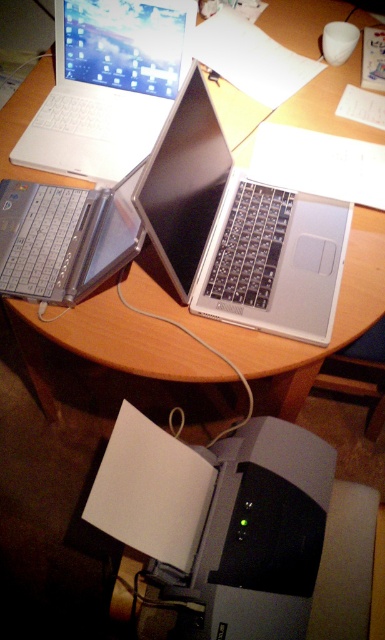
Can you confirm if gray matte printer at lower center is wider than satin silver laptop at center?

Yes.

Is point (254, 440) closer to viewer compared to point (318, 280)?

Yes, it is.

Who is more distant from viewer, [297,428] or [180,108]?

The point [297,428] is behind.

At what (x,y) coordinates should I click in order to perform the action: click on gray matte printer at lower center. Please return your answer as a coordinate pair (x, y). This screenshot has height=640, width=385. Looking at the image, I should click on (222, 518).

Can you confirm if wooden round table at center is shorter than silver metallic laptop at upper left?

In fact, wooden round table at center may be taller than silver metallic laptop at upper left.

Which is below, wooden round table at center or silver metallic laptop at upper left?

wooden round table at center is below.

You are a GUI agent. You are given a task and a screenshot of the screen. Output one action in this format:
    pyautogui.click(x=<x>, y=<y>)
    Task: Click on the wooden round table at center
    This screenshot has height=640, width=385.
    Given the screenshot: What is the action you would take?
    pyautogui.click(x=274, y=337)

Identify the location of wooden round table at center. (274, 337).

Can you confirm if wooden round table at center is bigger than satin silver laptop at center?

Correct, wooden round table at center is larger in size than satin silver laptop at center.

Who is shorter, wooden round table at center or satin silver laptop at center?

satin silver laptop at center is shorter.

The image size is (385, 640). Describe the element at coordinates (274, 337) in the screenshot. I see `wooden round table at center` at that location.

I want to click on wooden round table at center, so click(274, 337).